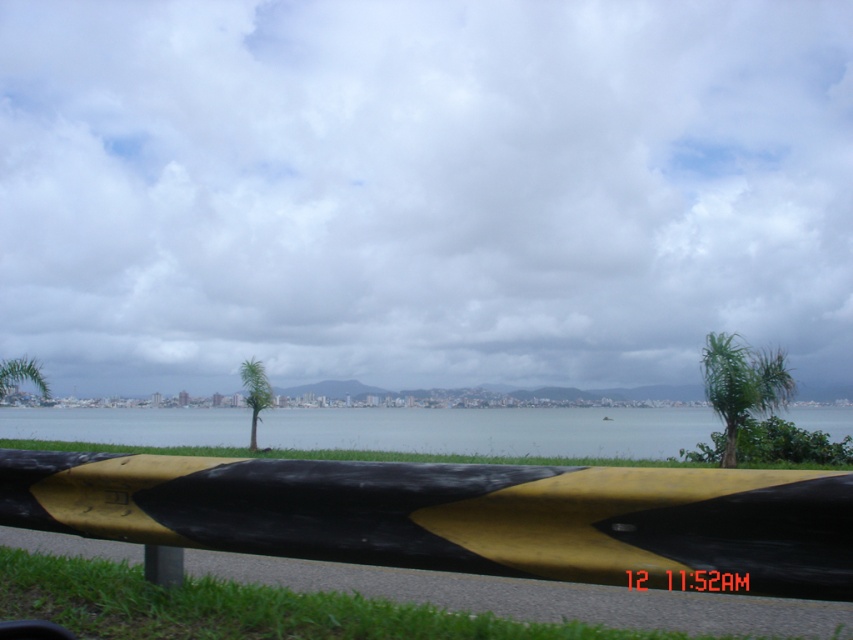
You are standing at the waterfront and see the blue water at center and the yellow matte pole at lower center. Which object is closer to you?

The yellow matte pole at lower center is behind the blue water at center, so the blue water at center is closer to you.

You are a painter who wants to paint both the yellow matte barrier at center and the yellow matte pole at lower center. Which object requires more paint to cover its surface?

The yellow matte barrier at center might be wider than yellow matte pole at lower center, so it requires more paint to cover its surface.

You are standing at the center of the image and want to place a new decorative stone exactly at the position where the yellow matte barrier at center is located. What are the coordinates where you should place the stone?

You should place the decorative stone at the coordinates point (x=459, y=515) where the yellow matte barrier at center is located.